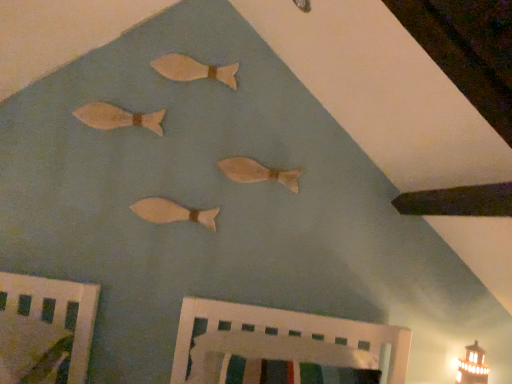
Image resolution: width=512 pixels, height=384 pixels. I want to click on wooden fish at upper center, which appears as the fourth fish when ordered from the bottom, so [x=193, y=70].

The image size is (512, 384). Identify the location of matte white lighthouse at lower right. pos(472,366).

What do you see at coordinates (44, 325) in the screenshot? I see `wooden bed frame at lower left, the second furniture when ordered from right to left` at bounding box center [44, 325].

What are the coordinates of `matte wooden fish at center, which ranks as the third fish in top-to-bottom order` in the screenshot? It's located at (257, 172).

Does matte white lighthouse at lower right have a greater width compared to wooden fish at center, which is counted as the 1th fish, starting from the bottom?

Correct, the width of matte white lighthouse at lower right exceeds that of wooden fish at center, which is counted as the 1th fish, starting from the bottom.

From a real-world perspective, is matte white lighthouse at lower right located higher than wooden fish at center, positioned as the 4th fish in top-to-bottom order?

No, from a real-world perspective, matte white lighthouse at lower right is not over wooden fish at center, positioned as the 4th fish in top-to-bottom order

What's the angular difference between matte white lighthouse at lower right and wooden fish at center, which is counted as the 1th fish, starting from the bottom,'s facing directions?

There is a 3.69-degree angle between the facing directions of matte white lighthouse at lower right and wooden fish at center, which is counted as the 1th fish, starting from the bottom.

Identify the location of fish that is the 1st object located above the matte white lighthouse at lower right (from the image's perspective). (173, 212).

Can wooden fish at upper left, which appears as the second fish when viewed from the top, be found inside wooden fish at upper center, which appears as the fourth fish when ordered from the bottom?

No.

From the image's perspective, is wooden fish at upper center, which is counted as the first fish, starting from the top, under wooden fish at upper left, acting as the third fish starting from the bottom?

No, from the image's perspective, wooden fish at upper center, which is counted as the first fish, starting from the top, is not below wooden fish at upper left, acting as the third fish starting from the bottom.

Considering the positions of point (187, 58) and point (92, 120), is point (187, 58) closer or farther from the camera than point (92, 120)?

Point (187, 58) is positioned farther from the camera compared to point (92, 120).

Is wooden fish at center, which is counted as the 1th fish, starting from the bottom, bigger than white painted wood crib at lower center, the second furniture from the left?

Incorrect, wooden fish at center, which is counted as the 1th fish, starting from the bottom, is not larger than white painted wood crib at lower center, the second furniture from the left.

Consider the image. From a real-world perspective, is wooden fish at center, positioned as the 4th fish in top-to-bottom order, physically above white painted wood crib at lower center, the second furniture from the left?

Correct, in the physical world, wooden fish at center, positioned as the 4th fish in top-to-bottom order, is higher than white painted wood crib at lower center, the second furniture from the left.

How many degrees apart are the facing directions of wooden fish at center, positioned as the 4th fish in top-to-bottom order, and white painted wood crib at lower center, marked as the 1th furniture in a right-to-left arrangement?

The angle between the facing direction of wooden fish at center, positioned as the 4th fish in top-to-bottom order, and the facing direction of white painted wood crib at lower center, marked as the 1th furniture in a right-to-left arrangement, is 92.9 degrees.

Can you confirm if wooden fish at center, positioned as the 4th fish in top-to-bottom order, is wider than white painted wood crib at lower center, the second furniture from the left?

In fact, wooden fish at center, positioned as the 4th fish in top-to-bottom order, might be narrower than white painted wood crib at lower center, the second furniture from the left.

From a real-world perspective, is wooden bed frame at lower left, the second furniture when ordered from right to left, positioned under wooden fish at upper left, which appears as the second fish when viewed from the top, based on gravity?

Yes, from a real-world perspective, wooden bed frame at lower left, the second furniture when ordered from right to left, is under wooden fish at upper left, which appears as the second fish when viewed from the top.

Looking at this image, is wooden fish at upper left, acting as the third fish starting from the bottom, completely or partially inside wooden bed frame at lower left, the second furniture when ordered from right to left?

That's incorrect, wooden fish at upper left, acting as the third fish starting from the bottom, is not inside wooden bed frame at lower left, the second furniture when ordered from right to left.

What's the angular difference between wooden bed frame at lower left, the second furniture when ordered from right to left, and wooden fish at upper left, which appears as the second fish when viewed from the top,'s facing directions?

91.1 degrees separate the facing orientations of wooden bed frame at lower left, the second furniture when ordered from right to left, and wooden fish at upper left, which appears as the second fish when viewed from the top.

Does point (94, 287) come farther from viewer compared to point (77, 112)?

No.

Which of these two, matte wooden fish at center, which ranks as the third fish in top-to-bottom order, or wooden fish at upper left, acting as the third fish starting from the bottom, stands shorter?

matte wooden fish at center, which ranks as the third fish in top-to-bottom order, is shorter.

In the scene shown: From the image's perspective, which one is positioned lower, matte wooden fish at center, which ranks as the third fish in top-to-bottom order, or wooden fish at upper left, acting as the third fish starting from the bottom?

matte wooden fish at center, which ranks as the third fish in top-to-bottom order, from the image's perspective.

Relative to wooden fish at upper left, which appears as the second fish when viewed from the top, is matte wooden fish at center, which ranks as the third fish in top-to-bottom order, in front or behind?

Visually, matte wooden fish at center, which ranks as the third fish in top-to-bottom order, is located behind wooden fish at upper left, which appears as the second fish when viewed from the top.

Locate an element on the screen. the 3rd fish counting from the right of the wooden fish at upper left, acting as the third fish starting from the bottom is located at coordinates (257, 172).

Is wooden bed frame at lower left, which is counted as the first furniture, starting from the left, bigger or smaller than matte white lighthouse at lower right?

In the image, wooden bed frame at lower left, which is counted as the first furniture, starting from the left, appears to be larger than matte white lighthouse at lower right.

Is wooden bed frame at lower left, which is counted as the first furniture, starting from the left, further to camera compared to matte white lighthouse at lower right?

No, wooden bed frame at lower left, which is counted as the first furniture, starting from the left, is in front of matte white lighthouse at lower right.

Does wooden bed frame at lower left, which is counted as the first furniture, starting from the left, have a lesser height compared to matte white lighthouse at lower right?

Yes.

Is wooden bed frame at lower left, the second furniture when ordered from right to left, surrounding matte white lighthouse at lower right?

No, wooden bed frame at lower left, the second furniture when ordered from right to left, does not contain matte white lighthouse at lower right.

Consider the image. Would you consider white painted wood crib at lower center, marked as the 1th furniture in a right-to-left arrangement, to be distant from matte wooden fish at center, which ranks as the third fish in top-to-bottom order?

No, white painted wood crib at lower center, marked as the 1th furniture in a right-to-left arrangement, is in close proximity to matte wooden fish at center, which ranks as the third fish in top-to-bottom order.

Looking at this image, which object is closer to the camera taking this photo, white painted wood crib at lower center, the second furniture from the left, or matte wooden fish at center, which ranks as the third fish in top-to-bottom order?

white painted wood crib at lower center, the second furniture from the left.

Which is less distant, (352, 364) or (226, 160)?

Positioned in front is point (352, 364).

Between white painted wood crib at lower center, marked as the 1th furniture in a right-to-left arrangement, and matte wooden fish at center, arranged as the second fish when ordered from the bottom, which one has larger size?

With larger size is white painted wood crib at lower center, marked as the 1th furniture in a right-to-left arrangement.

The width and height of the screenshot is (512, 384). What are the coordinates of `the 1st fish above the matte white lighthouse at lower right (from a real-world perspective)` in the screenshot? It's located at coord(173,212).

I want to click on the 2nd fish counting from the left side of the wooden fish at upper center, which is counted as the first fish, starting from the top, so click(x=118, y=117).

Estimate the real-world distances between objects in this image. Which object is further from matte wooden fish at center, which ranks as the third fish in top-to-bottom order, matte white lighthouse at lower right or wooden fish at center, which is counted as the 1th fish, starting from the bottom?

The object further to matte wooden fish at center, which ranks as the third fish in top-to-bottom order, is matte white lighthouse at lower right.

When comparing their distances from white painted wood crib at lower center, the second furniture from the left, does wooden fish at upper left, acting as the third fish starting from the bottom, or wooden fish at center, positioned as the 4th fish in top-to-bottom order, seem further?

The object further to white painted wood crib at lower center, the second furniture from the left, is wooden fish at upper left, acting as the third fish starting from the bottom.

Which object lies further to the anchor point matte wooden fish at center, which ranks as the third fish in top-to-bottom order, wooden bed frame at lower left, which is counted as the first furniture, starting from the left, or wooden fish at center, which is counted as the 1th fish, starting from the bottom?

The object further to matte wooden fish at center, which ranks as the third fish in top-to-bottom order, is wooden bed frame at lower left, which is counted as the first furniture, starting from the left.

When comparing their distances from matte wooden fish at center, which ranks as the third fish in top-to-bottom order, does matte white lighthouse at lower right or wooden fish at upper center, which appears as the fourth fish when ordered from the bottom, seem closer?

The object closer to matte wooden fish at center, which ranks as the third fish in top-to-bottom order, is wooden fish at upper center, which appears as the fourth fish when ordered from the bottom.

Looking at the image, which one is located closer to wooden fish at upper left, acting as the third fish starting from the bottom, matte wooden fish at center, arranged as the second fish when ordered from the bottom, or matte white lighthouse at lower right?

Among the two, matte wooden fish at center, arranged as the second fish when ordered from the bottom, is located nearer to wooden fish at upper left, acting as the third fish starting from the bottom.

Based on their spatial positions, is wooden fish at upper left, acting as the third fish starting from the bottom, or white painted wood crib at lower center, the second furniture from the left, closer to matte wooden fish at center, arranged as the second fish when ordered from the bottom?

Based on the image, wooden fish at upper left, acting as the third fish starting from the bottom, appears to be nearer to matte wooden fish at center, arranged as the second fish when ordered from the bottom.

Based on their spatial positions, is wooden fish at center, positioned as the 4th fish in top-to-bottom order, or wooden fish at upper left, acting as the third fish starting from the bottom, further from matte wooden fish at center, arranged as the second fish when ordered from the bottom?

wooden fish at upper left, acting as the third fish starting from the bottom, lies further to matte wooden fish at center, arranged as the second fish when ordered from the bottom, than the other object.

When comparing their distances from wooden fish at upper center, which appears as the fourth fish when ordered from the bottom, does matte white lighthouse at lower right or white painted wood crib at lower center, marked as the 1th furniture in a right-to-left arrangement, seem closer?

The object closer to wooden fish at upper center, which appears as the fourth fish when ordered from the bottom, is white painted wood crib at lower center, marked as the 1th furniture in a right-to-left arrangement.

The height and width of the screenshot is (384, 512). I want to click on furniture between wooden fish at upper left, which appears as the second fish when viewed from the top, and matte white lighthouse at lower right, so click(x=279, y=342).

Find the location of a particular element. The height and width of the screenshot is (384, 512). furniture between wooden fish at upper center, which appears as the fourth fish when ordered from the bottom, and white painted wood crib at lower center, marked as the 1th furniture in a right-to-left arrangement, from top to bottom is located at coordinates (44, 325).

Locate an element on the screen. Image resolution: width=512 pixels, height=384 pixels. furniture situated between matte wooden fish at center, which ranks as the third fish in top-to-bottom order, and matte white lighthouse at lower right from left to right is located at coordinates (279, 342).

You are a GUI agent. You are given a task and a screenshot of the screen. Output one action in this format:
    pyautogui.click(x=<x>, y=<y>)
    Task: Click on the furniture that lies between wooden fish at upper left, which appears as the second fish when viewed from the top, and white painted wood crib at lower center, marked as the 1th furniture in a right-to-left arrangement, from top to bottom
    The height and width of the screenshot is (384, 512).
    Given the screenshot: What is the action you would take?
    pyautogui.click(x=44, y=325)